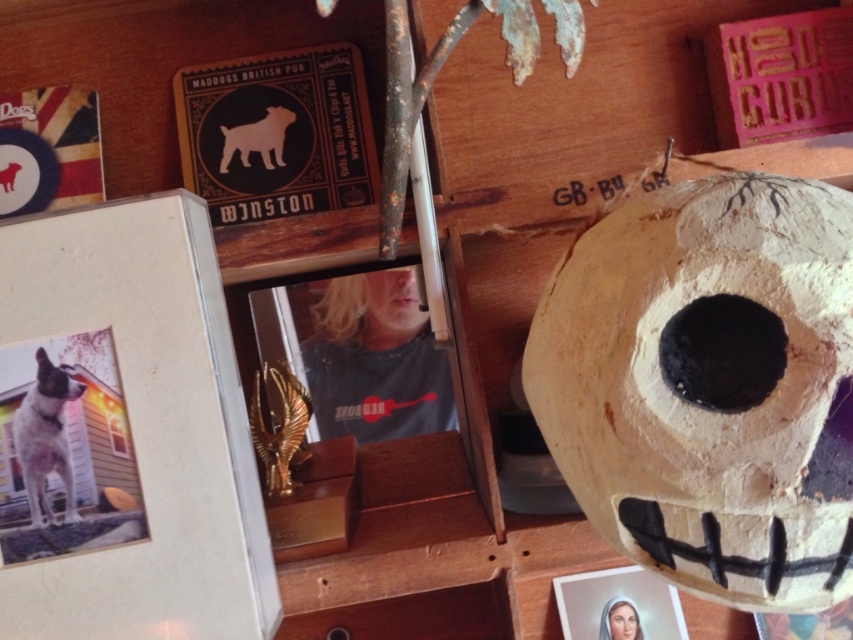
Is gray fabric shirt at center to the left of gold metallic eagle at center from the viewer's perspective?

Incorrect, gray fabric shirt at center is not on the left side of gold metallic eagle at center.

Locate an element on the screen. The width and height of the screenshot is (853, 640). gray fabric shirt at center is located at coordinates (376, 360).

This screenshot has height=640, width=853. Identify the location of gray fabric shirt at center. (376, 360).

Which is more to the left, matte black dog at upper left or smooth skin portrait at lower right?

matte black dog at upper left is more to the left.

Which is behind, point (223, 150) or point (614, 612)?

Positioned behind is point (614, 612).

In order to click on matte black dog at upper left in this screenshot , I will do `click(257, 138)`.

Is gray fabric shirt at center positioned before smooth skin portrait at lower right?

No, it is not.

Between point (347, 321) and point (611, 621), which one is positioned in front?

Point (611, 621)

Identify the location of gray fabric shirt at center. (376, 360).